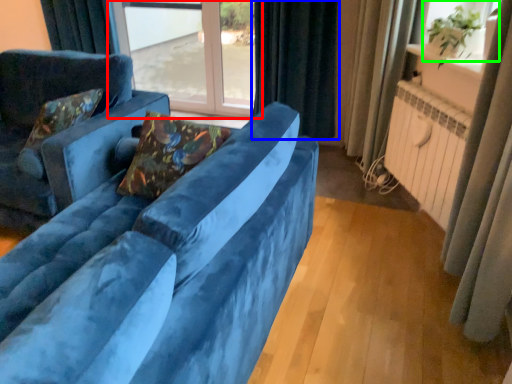
Question: Which object is the closest to the window (highlighted by a red box)? Choose among these: curtain (highlighted by a blue box) or window screen (highlighted by a green box).

Choices:
 (A) curtain
 (B) window screen

Answer: (A)